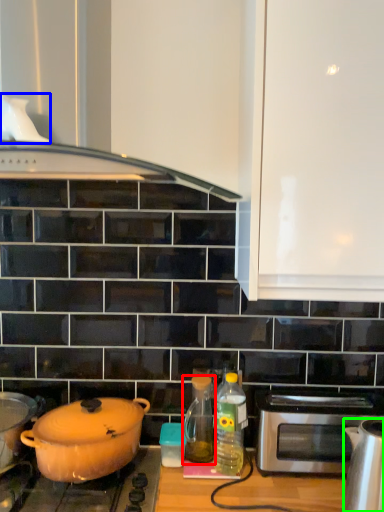
Question: Considering the real-world distances, which object is closest to bottle (highlighted by a red box)? kitchen appliance (highlighted by a blue box) or kitchen appliance (highlighted by a green box).

Choices:
 (A) kitchen appliance
 (B) kitchen appliance

Answer: (B)